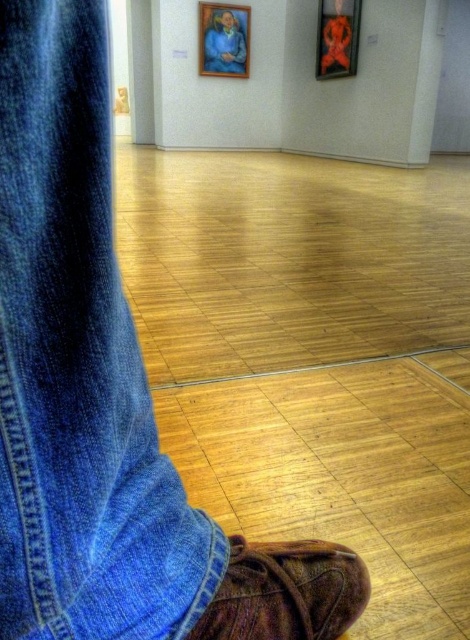
Question: Which is farther from the brown suede shoe at lower right?

Choices:
 (A) wooden frame at upper center
 (B) denim at left

Answer: (A)

Question: Does brown suede shoe at lower right appear on the right side of wooden frame at upper center?

Choices:
 (A) no
 (B) yes

Answer: (B)

Question: Which point is closer to the camera?

Choices:
 (A) wooden frame at upper center
 (B) brown suede shoe at lower right
 (C) denim at left
 (D) metallic gold picture frame at upper center

Answer: (C)

Question: Can you confirm if wooden frame at upper center is positioned to the right of metallic gold picture frame at upper center?

Choices:
 (A) yes
 (B) no

Answer: (B)

Question: Is denim at left to the right of brown suede shoe at lower right from the viewer's perspective?

Choices:
 (A) yes
 (B) no

Answer: (B)

Question: Which point appears farthest from the camera in this image?

Choices:
 (A) (147, 588)
 (B) (227, 64)

Answer: (B)